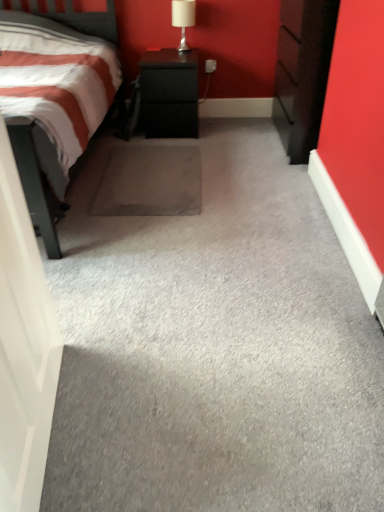
What are the coordinates of `vacant area that lies between black textured cabinet at center and white glossy door at left` in the screenshot? It's located at (136, 229).